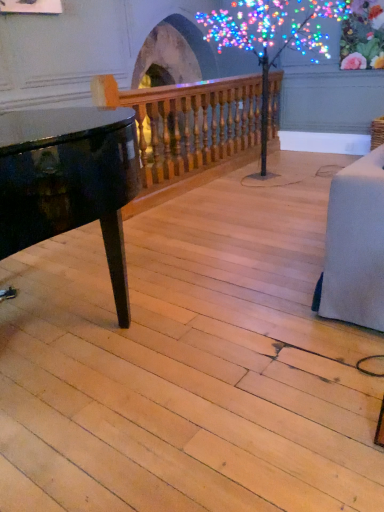
Question: Looking at the image, does wooden baluster at upper center seem bigger or smaller compared to illuminated plastic tree at center?

Choices:
 (A) big
 (B) small

Answer: (B)

Question: Is wooden baluster at upper center inside the boundaries of illuminated plastic tree at center, or outside?

Choices:
 (A) inside
 (B) outside

Answer: (A)

Question: From a real-world perspective, is wooden baluster at upper center positioned above or below illuminated plastic tree at center?

Choices:
 (A) above
 (B) below

Answer: (B)

Question: From the image's perspective, relative to wooden baluster at upper center, is illuminated plastic tree at center above or below?

Choices:
 (A) above
 (B) below

Answer: (A)

Question: Is illuminated plastic tree at center inside the boundaries of wooden baluster at upper center, or outside?

Choices:
 (A) outside
 (B) inside

Answer: (A)

Question: From a real-world perspective, is illuminated plastic tree at center physically located above or below wooden baluster at upper center?

Choices:
 (A) above
 (B) below

Answer: (A)

Question: In the image, is illuminated plastic tree at center positioned in front of or behind wooden baluster at upper center?

Choices:
 (A) behind
 (B) front

Answer: (B)